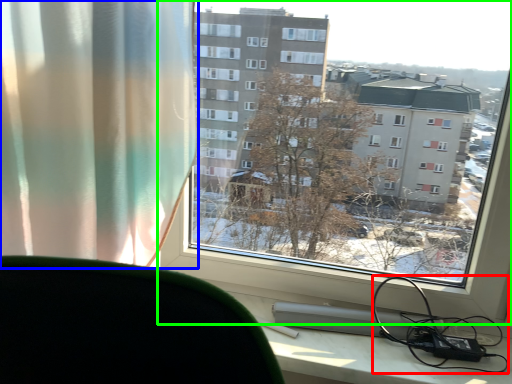
Question: Which object is positioned closest to cable (highlighted by a red box)? Select from curtain (highlighted by a blue box) and window (highlighted by a green box).

Choices:
 (A) curtain
 (B) window

Answer: (B)